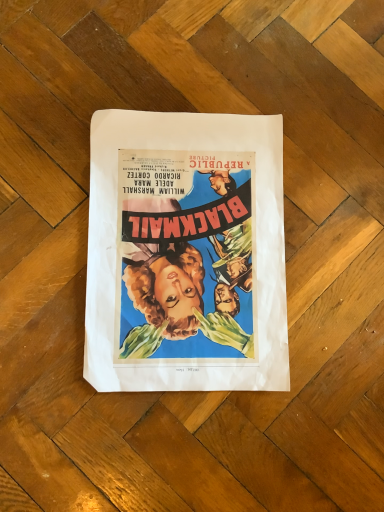
In order to face vibrant paper poster at center, should I rotate leftwards or rightwards?

You should look right and rotate roughly 1.280 degrees.

You are a GUI agent. You are given a task and a screenshot of the screen. Output one action in this format:
    pyautogui.click(x=<x>, y=<y>)
    Task: Click on the vibrant paper poster at center
    This screenshot has width=384, height=512.
    Given the screenshot: What is the action you would take?
    pyautogui.click(x=186, y=253)

Describe the element at coordinates (186, 253) in the screenshot. This screenshot has width=384, height=512. I see `vibrant paper poster at center` at that location.

Where is `vibrant paper poster at center`? Image resolution: width=384 pixels, height=512 pixels. vibrant paper poster at center is located at coordinates (186, 253).